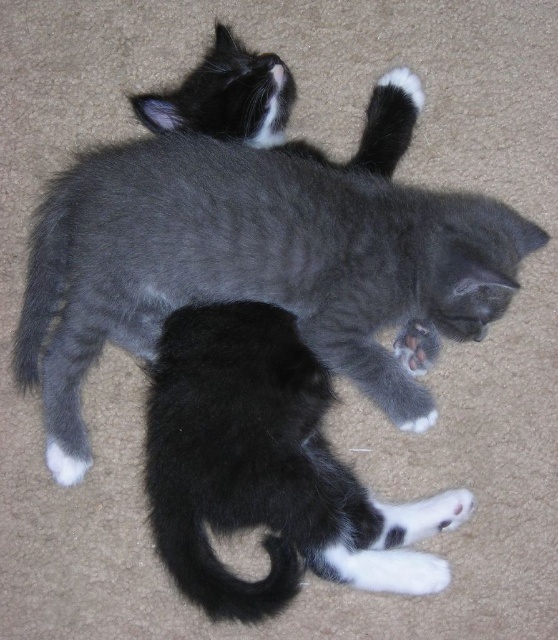
Question: Considering the relative positions of soft gray fur cat at center and black soft fur kitten at center in the image provided, where is soft gray fur cat at center located with respect to black soft fur kitten at center?

Choices:
 (A) right
 (B) left

Answer: (B)

Question: Can you confirm if soft gray fur cat at center is thinner than black soft fur kitten at center?

Choices:
 (A) no
 (B) yes

Answer: (A)

Question: Is soft gray fur cat at center wider than black soft fur kitten at center?

Choices:
 (A) no
 (B) yes

Answer: (B)

Question: Based on their relative distances, which object is farther from the white fur at lower center?

Choices:
 (A) soft gray fur cat at center
 (B) black soft fur kitten at center

Answer: (B)

Question: Among these points, which one is farthest from the camera?

Choices:
 (A) (392, 541)
 (B) (406, 326)
 (C) (473, 320)

Answer: (B)

Question: Which of these objects is positioned farthest from the black soft fur kitten at center?

Choices:
 (A) white fur at lower center
 (B) soft gray fur cat at center

Answer: (A)